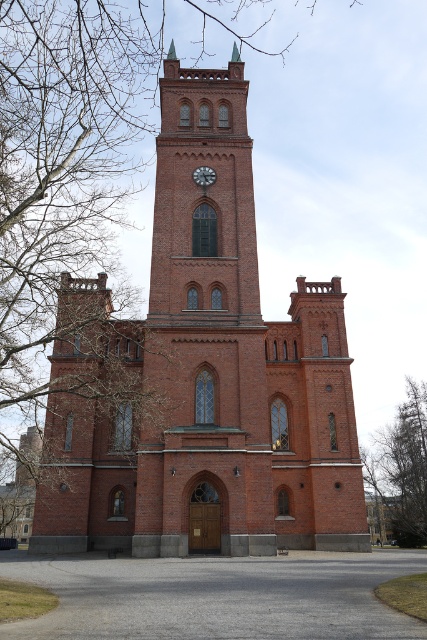
Question: Which is nearer to the red brick church at center?

Choices:
 (A) red brick clock tower at center
 (B) green leafy tree at right
 (C) white painted metal clock at upper center

Answer: (A)

Question: Is the position of red brick church at center more distant than that of red brick clock tower at center?

Choices:
 (A) no
 (B) yes

Answer: (A)

Question: Can you confirm if red brick clock tower at center is bigger than green leafy tree at right?

Choices:
 (A) no
 (B) yes

Answer: (B)

Question: Which of these objects is positioned farthest from the red brick church at center?

Choices:
 (A) red brick clock tower at center
 (B) green leafy tree at right
 (C) white painted metal clock at upper center

Answer: (B)

Question: Does green leafy tree at right lie behind white painted metal clock at upper center?

Choices:
 (A) no
 (B) yes

Answer: (B)

Question: Among these points, which one is farthest from the camera?

Choices:
 (A) (199, 168)
 (B) (195, 140)

Answer: (B)